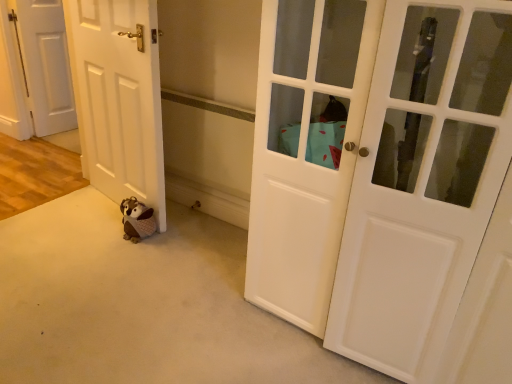
Question: Is white glossy door at center, acting as the 1th door starting from the right, in front of or behind white matte door at left, the 1th door in the left-to-right sequence, in the image?

Choices:
 (A) behind
 (B) front

Answer: (B)

Question: From a real-world perspective, is white glossy door at center, placed as the 1th door when sorted from front to back, physically located above or below white matte door at left, the first door when ordered from back to front?

Choices:
 (A) below
 (B) above

Answer: (B)

Question: Based on their relative distances, which object is farther from the white matte door at left, the 1th door in the left-to-right sequence?

Choices:
 (A) white matte door at left, the second door in the back-to-front sequence
 (B) plush brown bear at lower left
 (C) white glossy door at center, placed as the 3th door when sorted from left to right

Answer: (C)

Question: Which object is the closest to the white matte door at left, which ranks as the third door in front-to-back order?

Choices:
 (A) white matte door at left, arranged as the 2th door when viewed from the left
 (B) plush brown bear at lower left
 (C) white glossy door at center, which is counted as the 3th door, starting from the back

Answer: (A)